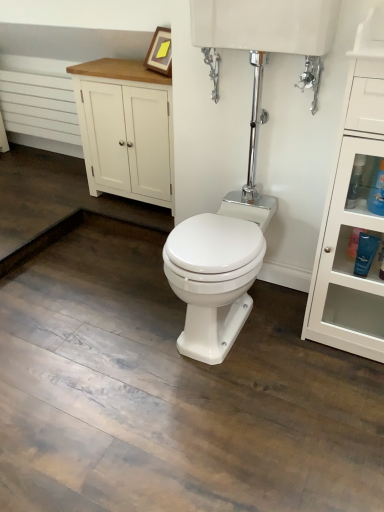
What do you see at coordinates (125, 129) in the screenshot?
I see `white painted wood cabinet at upper left` at bounding box center [125, 129].

Consider the image. What is the approximate width of white painted wood cabinet at upper left?

35.44 centimeters.

The image size is (384, 512). I want to click on white glossy cabinet at right, so click(x=351, y=226).

This screenshot has height=512, width=384. What do you see at coordinates (351, 226) in the screenshot? I see `white glossy cabinet at right` at bounding box center [351, 226].

The image size is (384, 512). I want to click on white painted wood cabinet at upper left, so click(125, 129).

Is white glossy tank at upper center facing towards white glossy cabinet at right?

No, white glossy tank at upper center does not turn towards white glossy cabinet at right.

Who is more distant, white glossy tank at upper center or white glossy cabinet at right?

white glossy tank at upper center is more distant.

From the image's perspective, is white glossy tank at upper center below white glossy cabinet at right?

No, from the image's perspective, white glossy tank at upper center is not below white glossy cabinet at right.

Which is correct: white painted wood cabinet at upper left is inside white glossy tank at upper center, or outside of it?

white painted wood cabinet at upper left is located beyond the bounds of white glossy tank at upper center.

Which of these two, white painted wood cabinet at upper left or white glossy tank at upper center, is wider?

Wider between the two is white painted wood cabinet at upper left.

Between white painted wood cabinet at upper left and white glossy tank at upper center, which one has smaller size?

With smaller size is white glossy tank at upper center.

From the image's perspective, is white painted wood cabinet at upper left above or below white glossy tank at upper center?

From the image's perspective, white painted wood cabinet at upper left appears below white glossy tank at upper center.

What's the angular difference between white glossy cabinet at right and white glossy tank at upper center's facing directions?

There is a 1.55-degree angle between the facing directions of white glossy cabinet at right and white glossy tank at upper center.

Based on the photo, would you say white glossy tank at upper center is part of white glossy cabinet at right's contents?

No, white glossy tank at upper center is located outside of white glossy cabinet at right.

Based on the photo, from the image's perspective, relative to white glossy tank at upper center, is white glossy cabinet at right above or below?

Clearly, from the image's perspective, white glossy cabinet at right is below white glossy tank at upper center.

Which is more distant, (370,117) or (264,1)?

The point (264,1) is more distant.

Which is in front, white glossy tank at upper center or blue glossy bottle at right?

white glossy tank at upper center.

Does point (233, 27) appear closer or farther from the camera than point (370, 234)?

Point (233, 27) appears to be closer to the viewer than point (370, 234).

Is blue glossy bottle at right located within white glossy tank at upper center?

Definitely not — blue glossy bottle at right is not inside white glossy tank at upper center.

Is white glossy tank at upper center wider than blue glossy bottle at right?

Indeed, white glossy tank at upper center has a greater width compared to blue glossy bottle at right.

Find the location of a particular element. This screenshot has width=384, height=512. bathroom cabinet above the white glossy cabinet at right (from the image's perspective) is located at coordinates (125, 129).

Is white painted wood cabinet at upper left turned away from white glossy cabinet at right?

No, white painted wood cabinet at upper left is not facing the opposite direction of white glossy cabinet at right.

Is white painted wood cabinet at upper left to the right of white glossy cabinet at right from the viewer's perspective?

In fact, white painted wood cabinet at upper left is to the left of white glossy cabinet at right.

Is white painted wood cabinet at upper left bigger than white glossy cabinet at right?

Correct, white painted wood cabinet at upper left is larger in size than white glossy cabinet at right.

Is blue glossy bottle at right beside white glossy cabinet at right?

blue glossy bottle at right and white glossy cabinet at right are clearly separated.

From a real-world perspective, which object stands above the other?

white glossy cabinet at right.

Is blue glossy bottle at right further to the viewer compared to white glossy cabinet at right?

Yes.

Does white glossy tank at upper center have a smaller size compared to white painted wood cabinet at upper left?

Indeed, white glossy tank at upper center has a smaller size compared to white painted wood cabinet at upper left.

From the image's perspective, is white glossy tank at upper center below white painted wood cabinet at upper left?

Incorrect, from the image's perspective, white glossy tank at upper center is higher than white painted wood cabinet at upper left.

Does white glossy tank at upper center lie in front of white painted wood cabinet at upper left?

Yes, white glossy tank at upper center is in front of white painted wood cabinet at upper left.

Looking at this image, is white glossy tank at upper center looking in the opposite direction of white painted wood cabinet at upper left?

white glossy tank at upper center is not turned away from white painted wood cabinet at upper left.

The width and height of the screenshot is (384, 512). Identify the location of sink above the white glossy cabinet at right (from a real-world perspective). (265, 25).

The width and height of the screenshot is (384, 512). I want to click on bathroom cabinet behind the white glossy tank at upper center, so click(x=125, y=129).

Which object lies nearer to the anchor point white glossy tank at upper center, blue glossy bottle at right or white glossy cabinet at right?

Based on the image, white glossy cabinet at right appears to be nearer to white glossy tank at upper center.

Looking at the image, which one is located closer to blue glossy bottle at right, white glossy tank at upper center or white painted wood cabinet at upper left?

white glossy tank at upper center is closer to blue glossy bottle at right.

Considering their positions, is blue glossy bottle at right positioned closer to white glossy cabinet at right than white glossy tank at upper center?

blue glossy bottle at right is positioned closer to the anchor white glossy cabinet at right.

Estimate the real-world distances between objects in this image. Which object is further from white glossy cabinet at right, white painted wood cabinet at upper left or white glossy tank at upper center?

white painted wood cabinet at upper left lies further to white glossy cabinet at right than the other object.

From the image, which object appears to be nearer to white glossy tank at upper center, blue glossy bottle at right or white painted wood cabinet at upper left?

blue glossy bottle at right is closer to white glossy tank at upper center.

Considering their positions, is white glossy cabinet at right positioned closer to white painted wood cabinet at upper left than white glossy tank at upper center?

white glossy tank at upper center.

From the image, which object appears to be farther from blue glossy bottle at right, white painted wood cabinet at upper left or white glossy tank at upper center?

Based on the image, white painted wood cabinet at upper left appears to be further to blue glossy bottle at right.

From the picture: Which object lies further to the anchor point white glossy tank at upper center, white painted wood cabinet at upper left or blue glossy bottle at right?

white painted wood cabinet at upper left lies further to white glossy tank at upper center than the other object.

Where is `sink between white glossy cabinet at right and white painted wood cabinet at upper left along the z-axis`? This screenshot has height=512, width=384. sink between white glossy cabinet at right and white painted wood cabinet at upper left along the z-axis is located at coordinates (265, 25).

The image size is (384, 512). I want to click on sink located between white painted wood cabinet at upper left and blue glossy bottle at right in the left-right direction, so click(265, 25).

Image resolution: width=384 pixels, height=512 pixels. I want to click on toiletry located between white painted wood cabinet at upper left and white glossy cabinet at right in the left-right direction, so click(x=365, y=253).

This screenshot has height=512, width=384. I want to click on dresser between white glossy tank at upper center and blue glossy bottle at right from top to bottom, so click(351, 226).